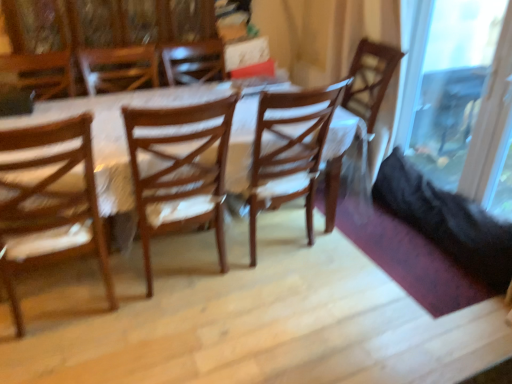
Locate an element on the screen. blank area beneath wooden chair at left, acting as the third chair starting from the right (from a real-world perspective) is located at coordinates (59, 303).